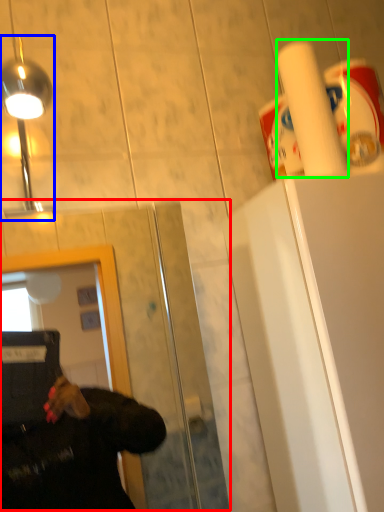
Question: Estimate the real-world distances between objects in this image. Which object is farther from glass door (highlighted by a red box), light fixture (highlighted by a blue box) or paper towel (highlighted by a green box)?

Choices:
 (A) light fixture
 (B) paper towel

Answer: (A)